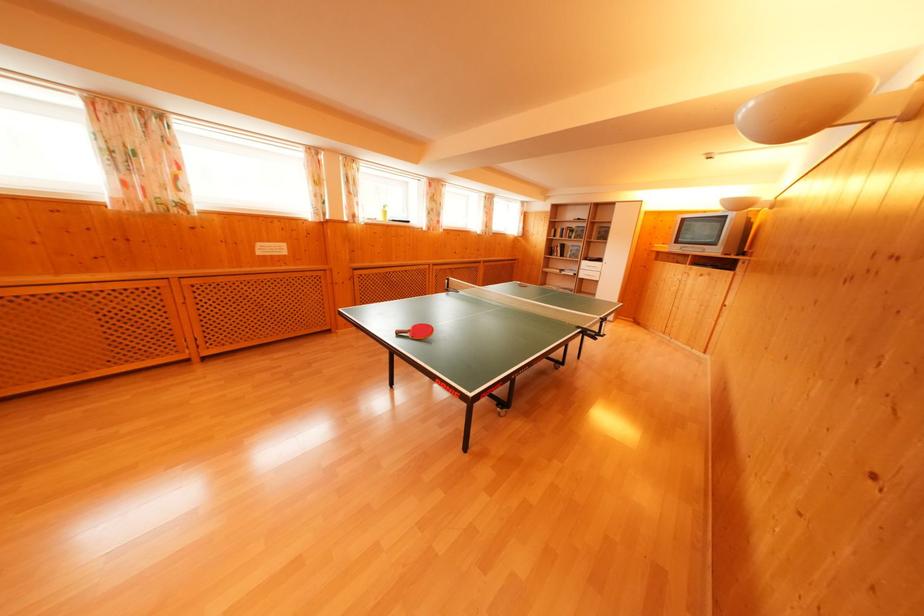
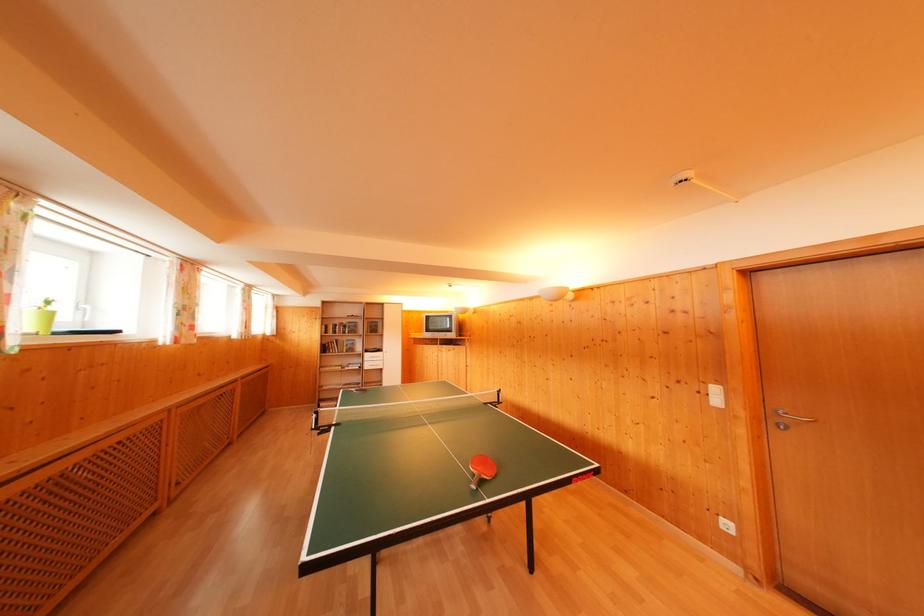
The point at [590,268] is marked in the first image. Where is the corresponding point in the second image?

(371, 360)